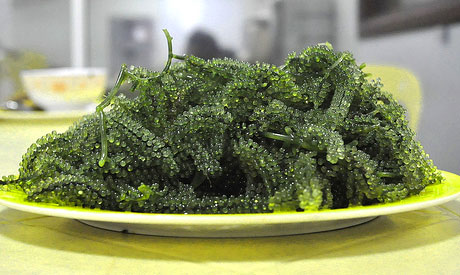
Identify the location of plate shadow. Image resolution: width=460 pixels, height=275 pixels. (412, 228).